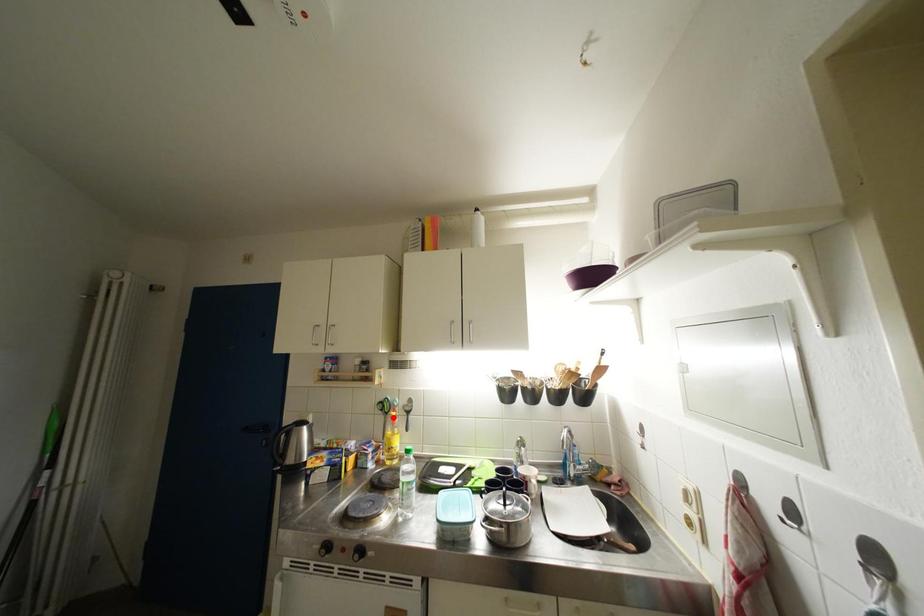
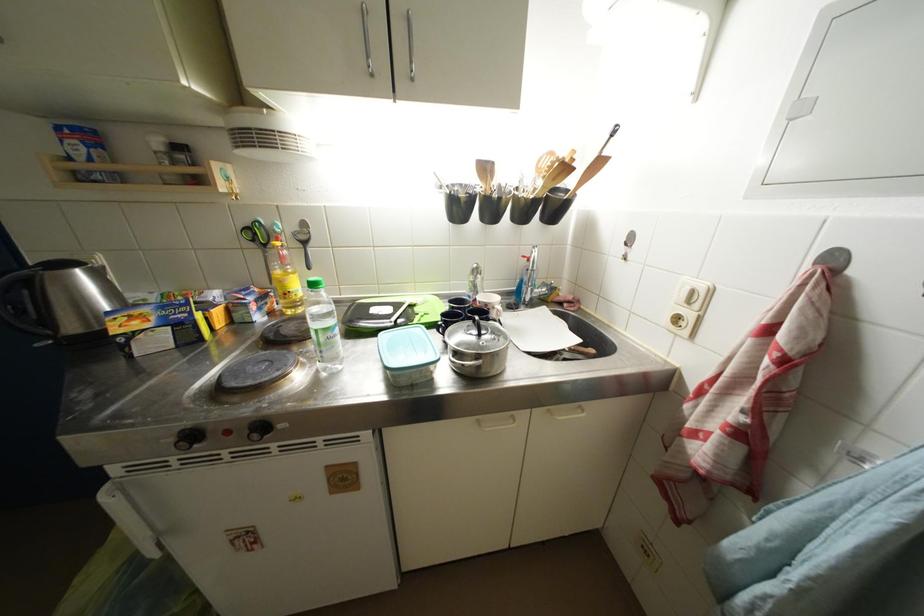
The point at the highlighted location is marked in the first image. Where is the corresponding point in the second image?

(272, 249)